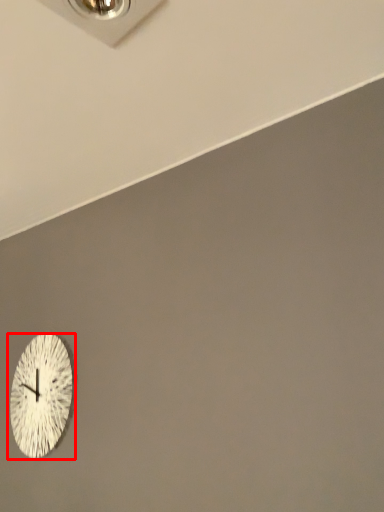
Question: From the image's perspective, what is the correct spatial relationship of wall clock (annotated by the red box) in relation to electric outlet?

Choices:
 (A) above
 (B) below

Answer: (B)